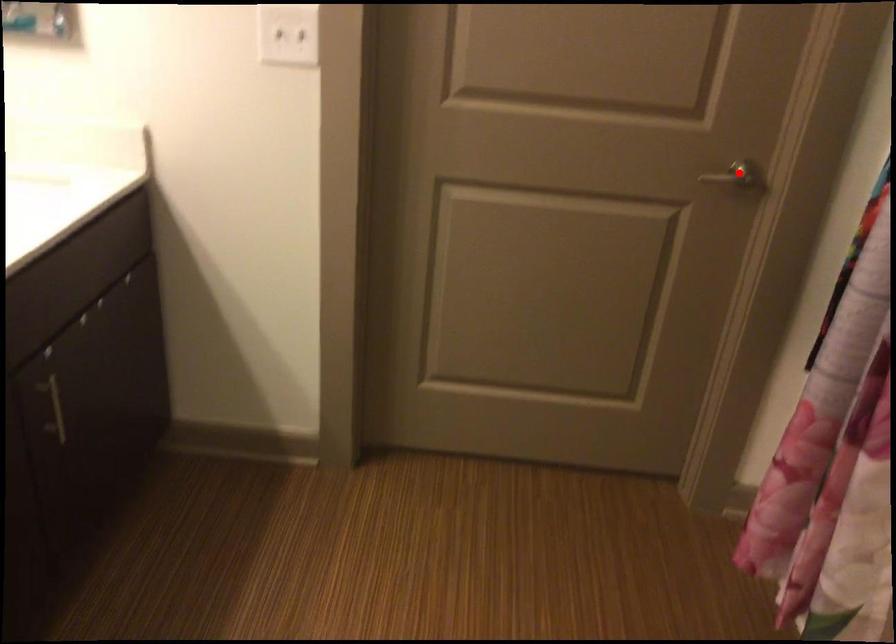
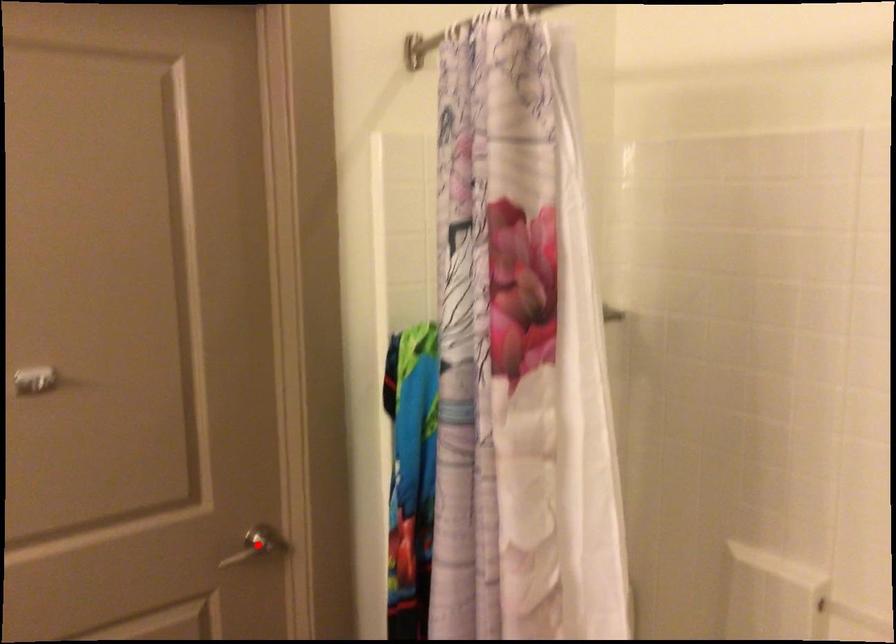
I am providing you with two images of the same scene from different viewpoints. A red point is marked on the first image and another point is marked on the second image. Is the marked point in image1 the same physical position as the marked point in image2?

Yes